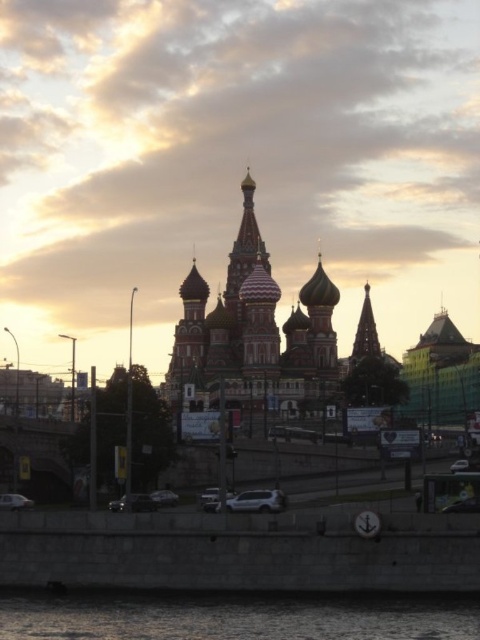
Question: Is red brick church at center closer to the viewer compared to dark gray concrete river at lower center?

Choices:
 (A) yes
 (B) no

Answer: (B)

Question: Which object is closer to the camera taking this photo?

Choices:
 (A) red brick church at center
 (B) dark gray concrete river at lower center

Answer: (B)

Question: Can you confirm if red brick church at center is positioned to the left of dark gray concrete river at lower center?

Choices:
 (A) yes
 (B) no

Answer: (B)

Question: Among these objects, which one is nearest to the camera?

Choices:
 (A) dark gray concrete river at lower center
 (B) red brick church at center

Answer: (A)

Question: Where is red brick church at center located in relation to dark gray concrete river at lower center in the image?

Choices:
 (A) below
 (B) above

Answer: (B)